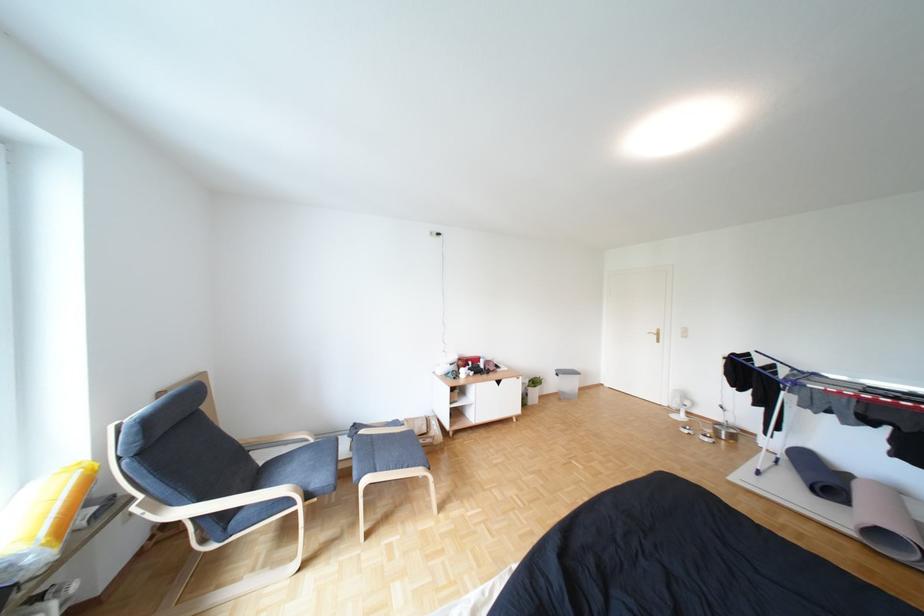
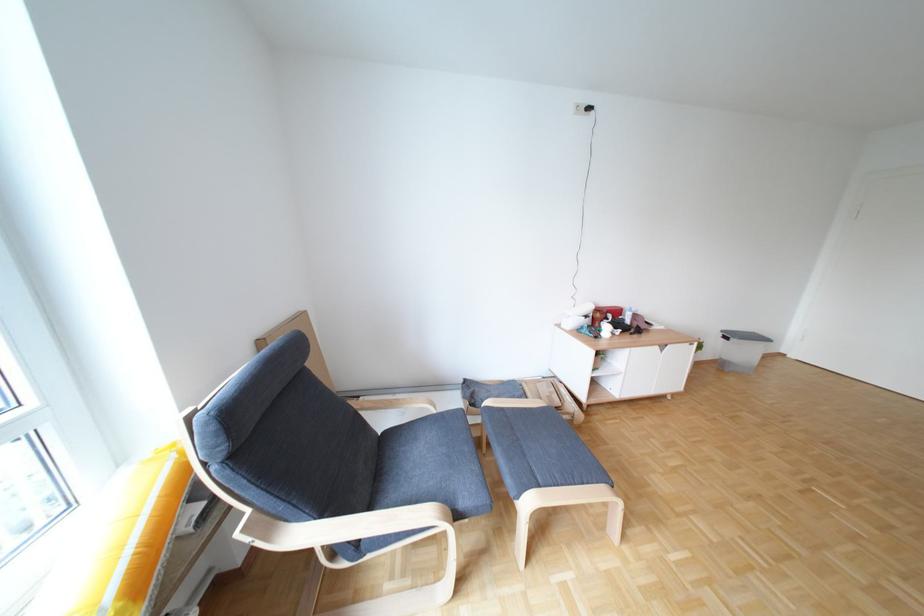
Where in the second image is the point corresponding to [149,509] from the first image?

(252, 535)